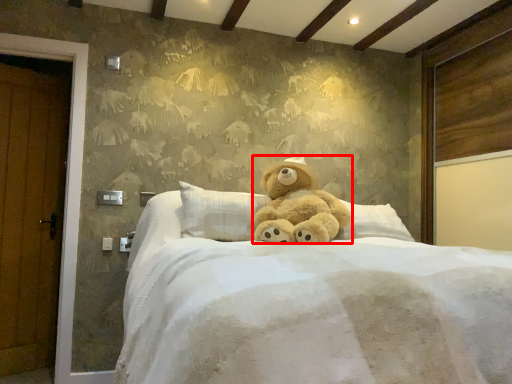
Question: Observing the image, what is the correct spatial positioning of teddy bear (annotated by the red box) in reference to bed?

Choices:
 (A) right
 (B) left

Answer: (B)